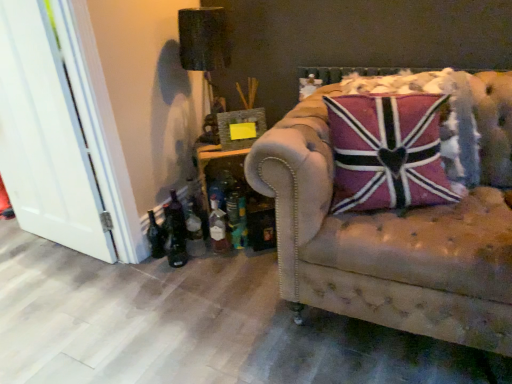
The image size is (512, 384). Identify the location of free location to the left of translucent glass bottle at lower left, the 2th bottle in the left-to-right sequence. (161, 265).